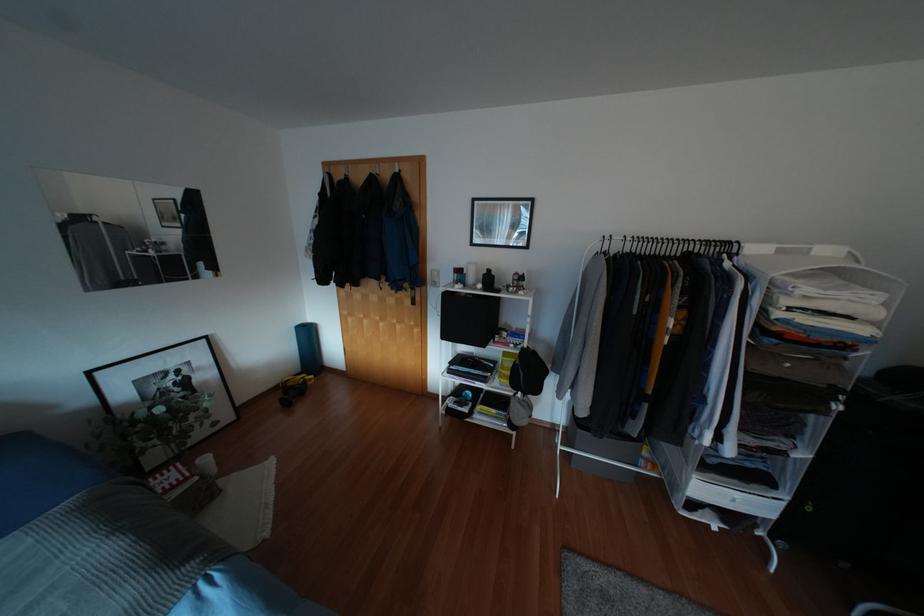
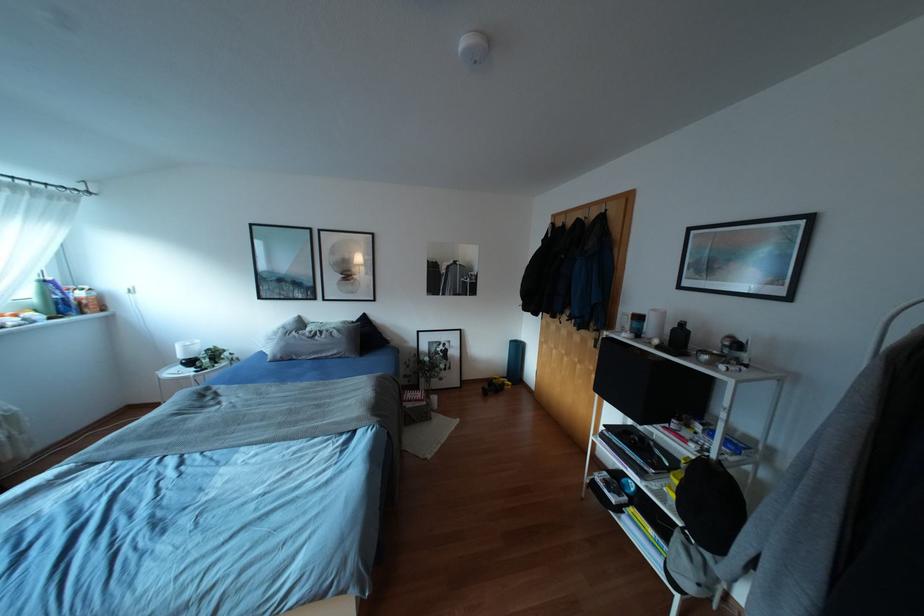
Locate, in the second image, the point that corresponds to the point at 488,270 in the first image.

(682, 323)